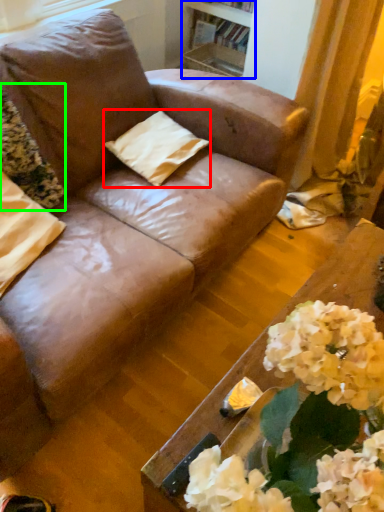
Question: Considering the real-world distances, which object is closest to pillow (highlighted by a red box)? bookshelf (highlighted by a blue box) or flower (highlighted by a green box).

Choices:
 (A) bookshelf
 (B) flower

Answer: (B)